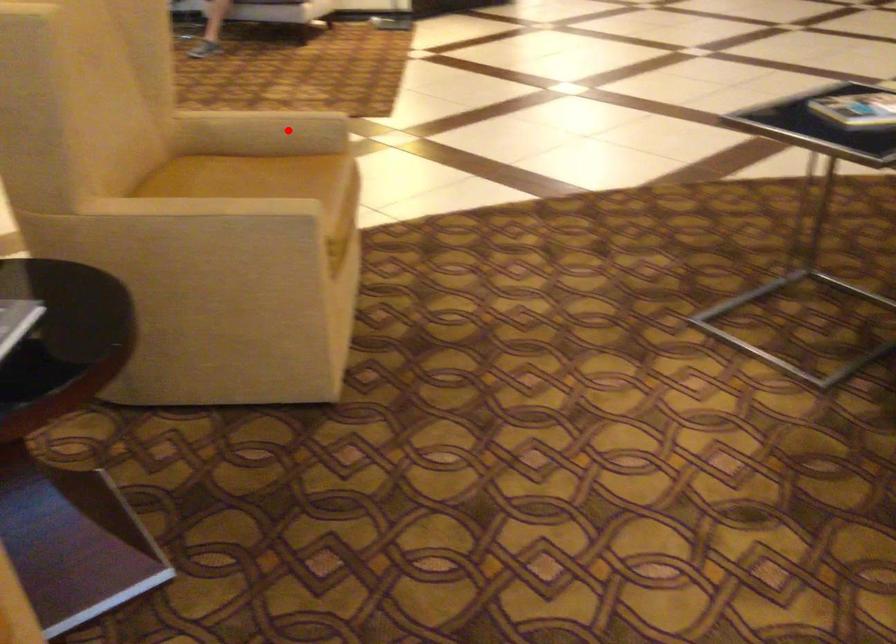
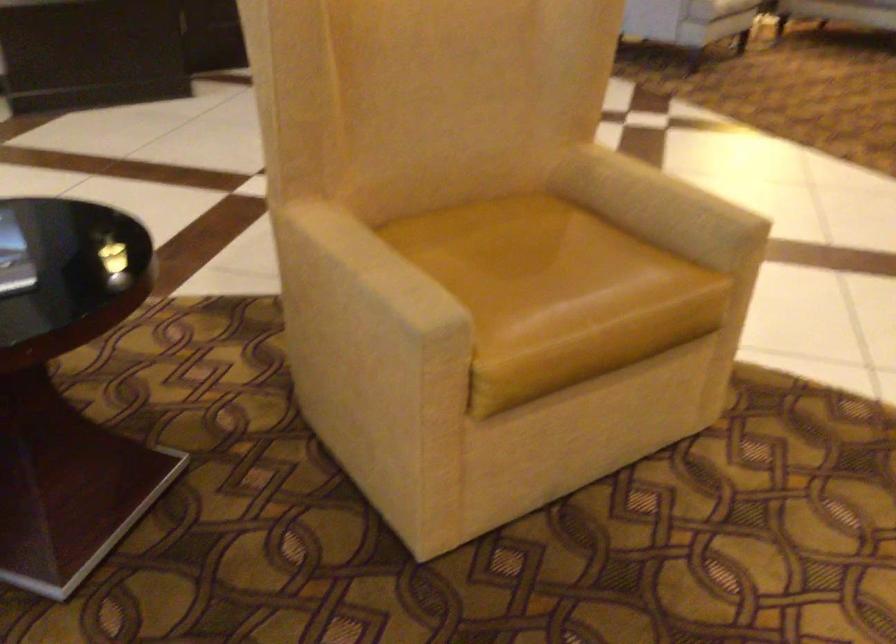
Find the pixel in the second image that matches the highlighted location in the first image.

(659, 205)